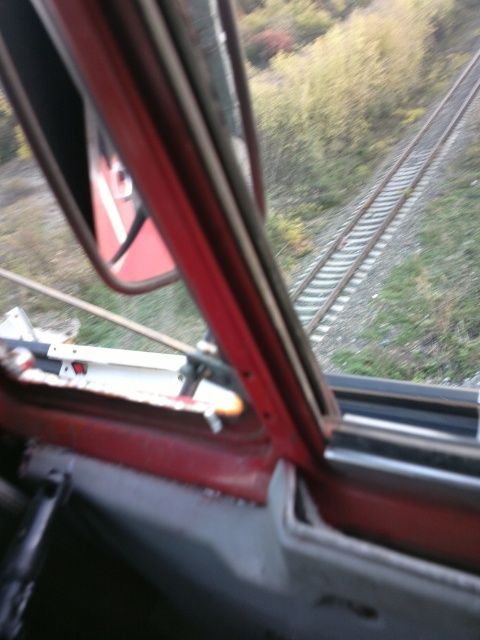
Which is more to the left, metallic silver train window at center or metal/smooth track at center?

Positioned to the left is metallic silver train window at center.

Does metallic silver train window at center have a lesser width compared to metal/smooth track at center?

Yes, metallic silver train window at center is thinner than metal/smooth track at center.

In order to click on metallic silver train window at center in this screenshot , I will do `click(79, 150)`.